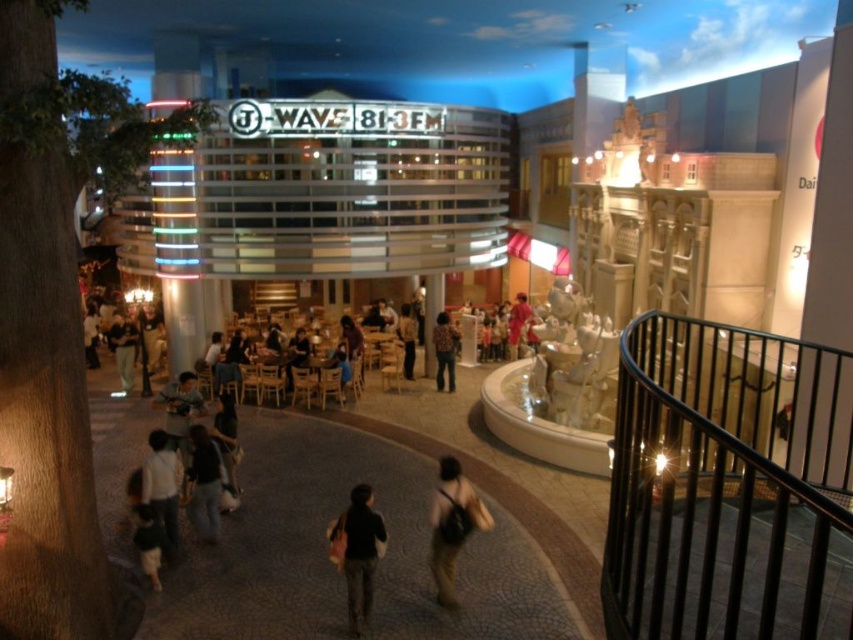
Can you confirm if light brown leather backpack at center is bigger than dark gray sweater at lower left?

Correct, light brown leather backpack at center is larger in size than dark gray sweater at lower left.

Is light brown leather backpack at center taller than dark gray sweater at lower left?

Correct, light brown leather backpack at center is much taller as dark gray sweater at lower left.

Is point (456, 516) in front of point (148, 544)?

Yes, it is.

Where is `light brown leather backpack at center`? The image size is (853, 640). light brown leather backpack at center is located at coordinates (451, 524).

Is the position of light brown leather backpack at center more distant than that of floral-patterned shirt at center?

No, it is in front of floral-patterned shirt at center.

I want to click on light brown leather backpack at center, so click(451, 524).

From the picture: Who is more distant from viewer, (456, 472) or (438, 353)?

Positioned behind is point (438, 353).

Where is `light brown leather backpack at center`? This screenshot has width=853, height=640. light brown leather backpack at center is located at coordinates (451, 524).

Locate an element on the screen. The width and height of the screenshot is (853, 640). dark fabric jacket at center is located at coordinates (357, 554).

Does dark fabric jacket at center have a larger size compared to dark gray backpack at center?

Yes.

Does point (368, 554) lie behind point (195, 500)?

No, (368, 554) is closer to viewer.

I want to click on dark fabric jacket at center, so click(357, 554).